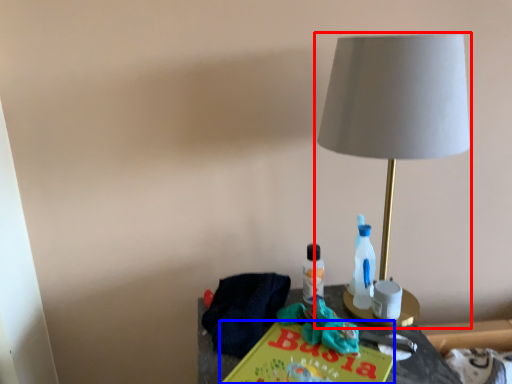
Question: Which of the following is the farthest to the observer, lamp (highlighted by a red box) or paperback book (highlighted by a blue box)?

Choices:
 (A) lamp
 (B) paperback book

Answer: (A)